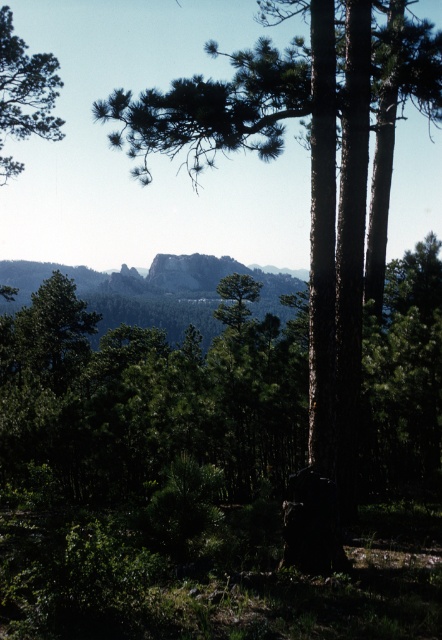
Can you confirm if green rough bark tree at center is smaller than green leafy tree at upper left?

Actually, green rough bark tree at center might be larger than green leafy tree at upper left.

Who is more distant from viewer, (323,531) or (44,100)?

The point (44,100) is behind.

The width and height of the screenshot is (442, 640). Describe the element at coordinates (311, 202) in the screenshot. I see `green rough bark tree at center` at that location.

The image size is (442, 640). Find the location of `green rough bark tree at center`. green rough bark tree at center is located at coordinates (311, 202).